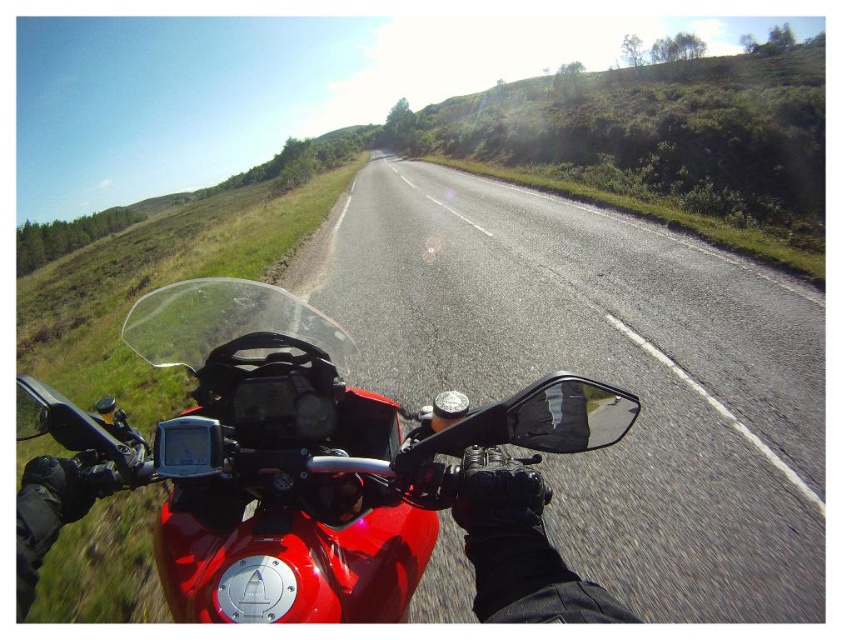
Does asphalt road at center lie behind glossy red motorcycle at center?

Yes, it is.

Does asphalt road at center have a smaller size compared to glossy red motorcycle at center?

Actually, asphalt road at center might be larger than glossy red motorcycle at center.

Is point (392, 244) positioned behind point (201, 540)?

Yes.

Find the location of a particular element. asphalt road at center is located at coordinates (603, 374).